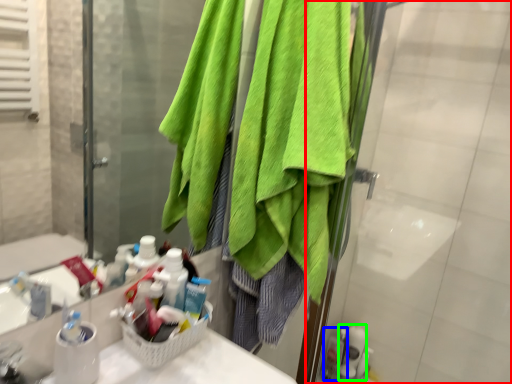
Question: Based on their relative distances, which object is farther from screen door (highlighted by a red box)? Choose from toiletry (highlighted by a blue box) and toiletry (highlighted by a green box).

Choices:
 (A) toiletry
 (B) toiletry

Answer: (A)